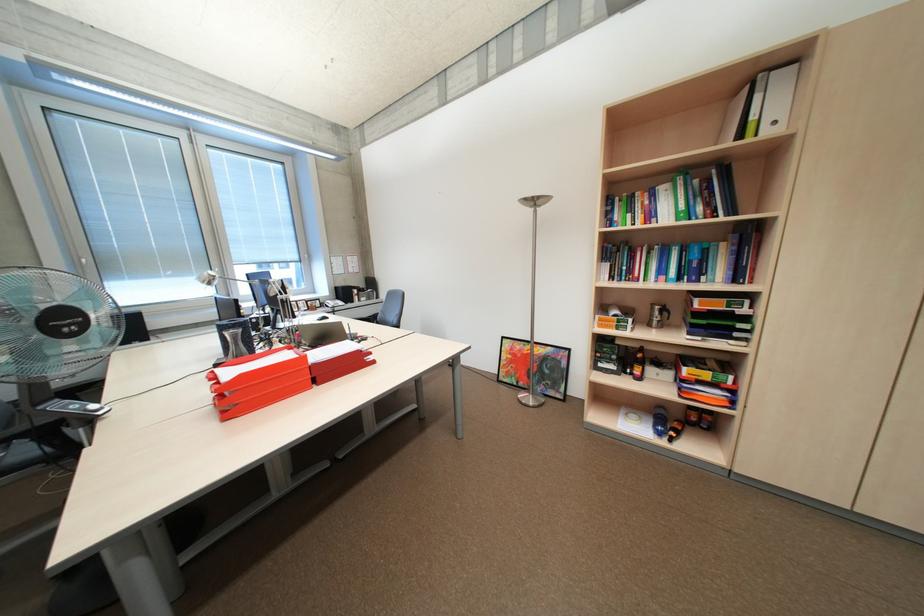
Where would you grasp the moka pot handle? Please return your answer as a coordinate pair (x, y).

(659, 314)